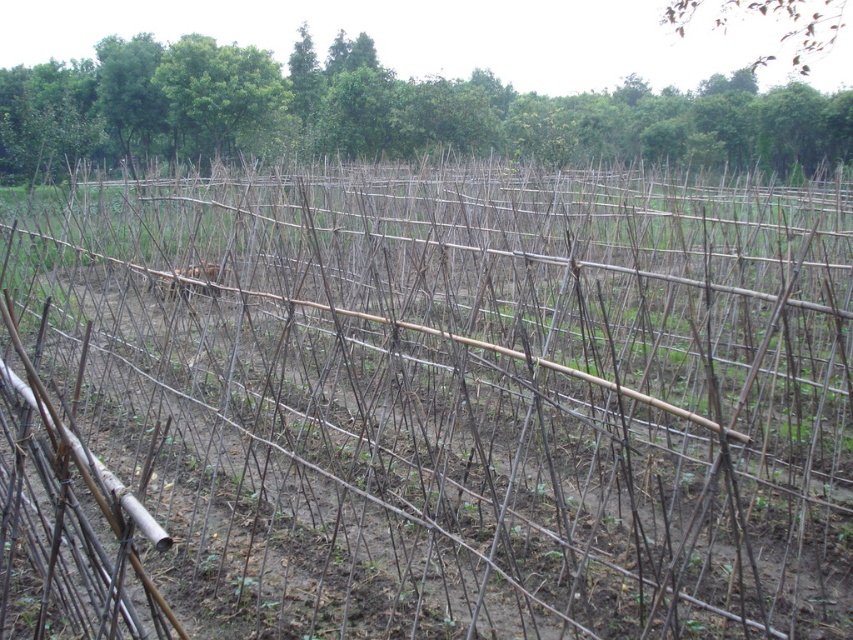
Does green leafy tree at upper center appear on the left side of brown wood tree at upper right?

Yes, green leafy tree at upper center is to the left of brown wood tree at upper right.

Is green leafy tree at upper center positioned behind brown wood tree at upper right?

Yes, green leafy tree at upper center is behind brown wood tree at upper right.

Is point (70, 77) positioned behind point (793, 0)?

Yes, point (70, 77) is farther from viewer.

I want to click on green leafy tree at upper center, so click(x=383, y=112).